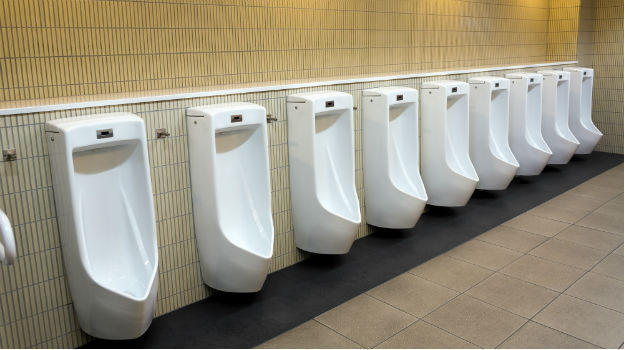
This screenshot has width=625, height=350. I want to click on white urnials, so click(x=135, y=125), click(x=214, y=114), click(x=321, y=110), click(x=396, y=98), click(x=450, y=93), click(x=492, y=83), click(x=528, y=85), click(x=557, y=81), click(x=589, y=75).